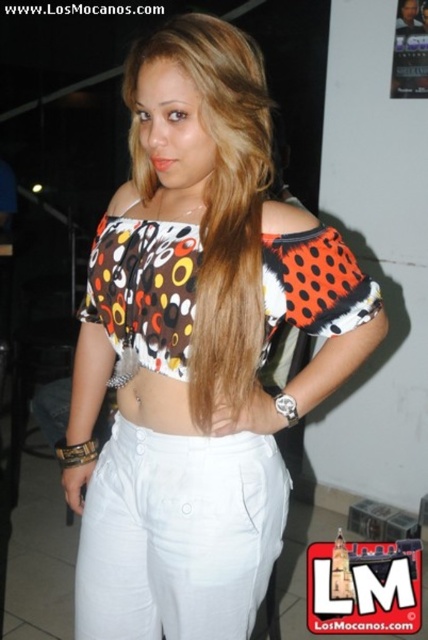
Question: Does white cotton pants at center have a smaller size compared to printed fabric bikini top at center?

Choices:
 (A) no
 (B) yes

Answer: (B)

Question: Is printed fabric top at center to the left of printed fabric bikini top at center from the viewer's perspective?

Choices:
 (A) no
 (B) yes

Answer: (A)

Question: Based on their relative distances, which object is farther from the printed fabric top at center?

Choices:
 (A) brown silky hair at center
 (B) white cotton pants at center

Answer: (A)

Question: Estimate the real-world distances between objects in this image. Which object is closer to the printed fabric bikini top at center?

Choices:
 (A) brown silky hair at center
 (B) printed fabric top at center

Answer: (B)

Question: Is printed fabric top at center wider than printed fabric bikini top at center?

Choices:
 (A) yes
 (B) no

Answer: (A)

Question: Which point is closer to the camera?

Choices:
 (A) white cotton pants at center
 (B) printed fabric bikini top at center
 (C) printed fabric top at center
 (D) brown silky hair at center

Answer: (D)